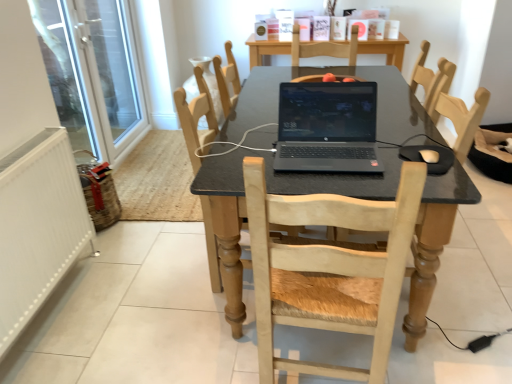
What are the coordinates of `vacant area that lies to the right of light wood chair at center, which ranks as the 1th chair in front-to-back order` in the screenshot? It's located at (432, 351).